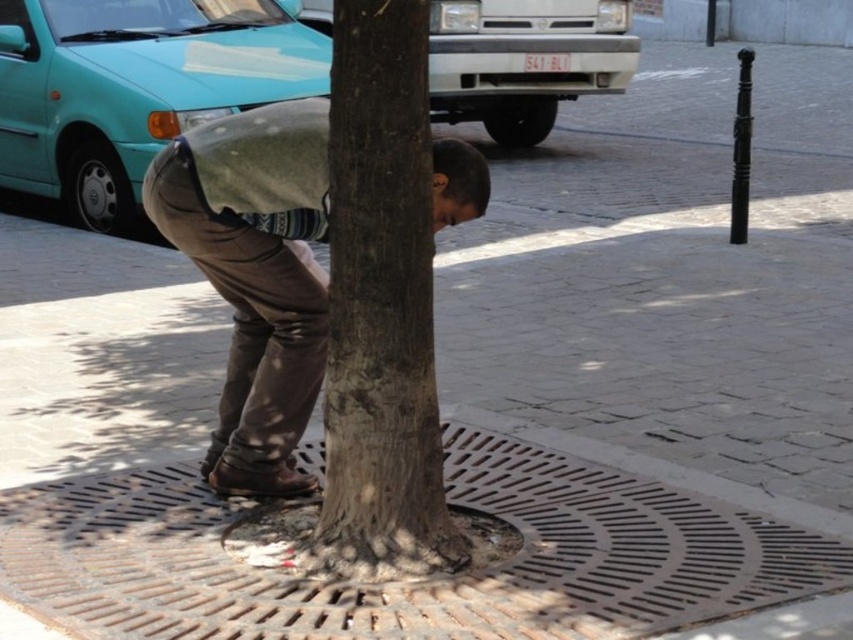
Does point (369, 401) lie behind point (305, 406)?

No, (369, 401) is closer to viewer.

Is brown rough bark at center bigger than brown leather pants at center?

Indeed, brown rough bark at center has a larger size compared to brown leather pants at center.

Find the location of `brown rough bark at center`. brown rough bark at center is located at coordinates (381, 307).